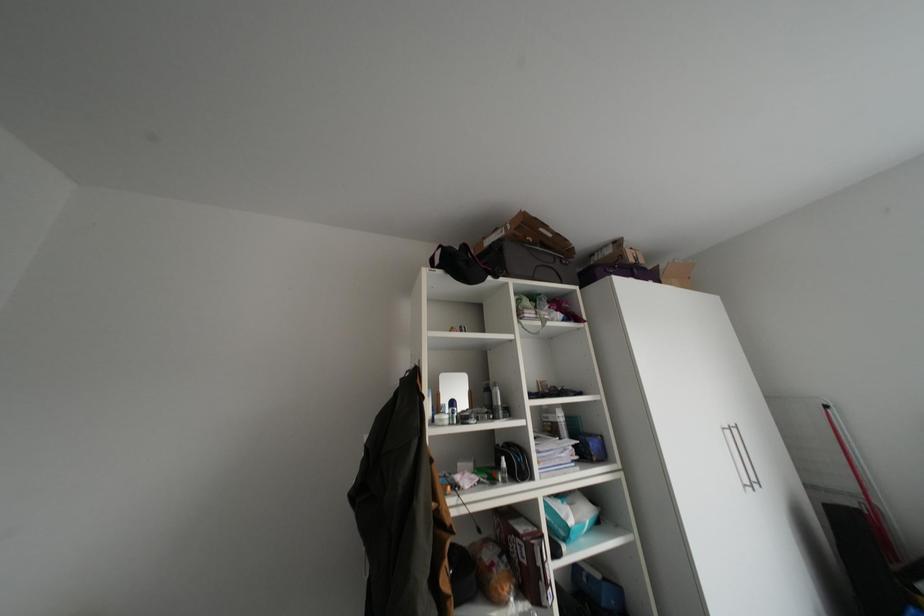
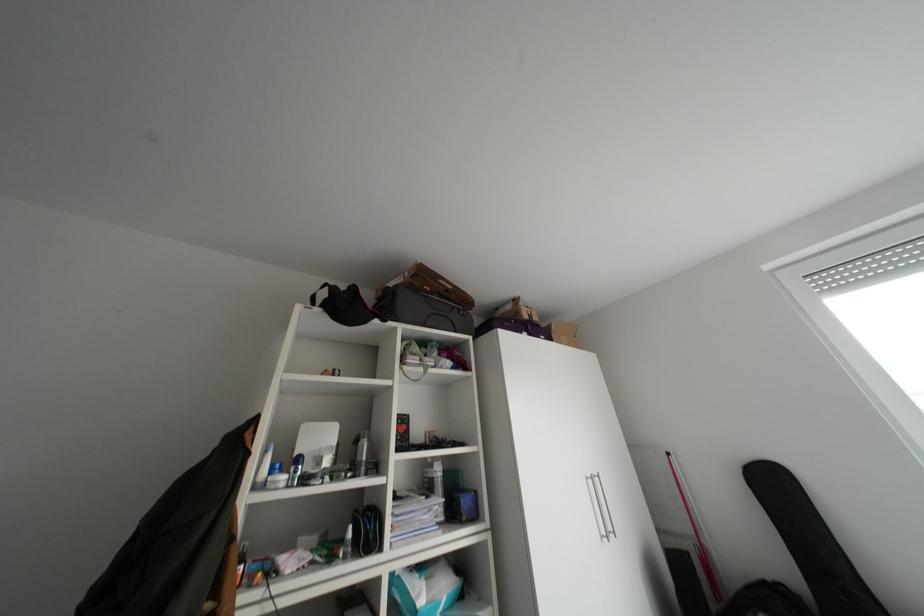
Question: In a continuous first-person perspective shot, in which direction is the camera moving?

Choices:
 (A) Left
 (B) Right
 (C) Forward
 (D) Backward

Answer: (B)